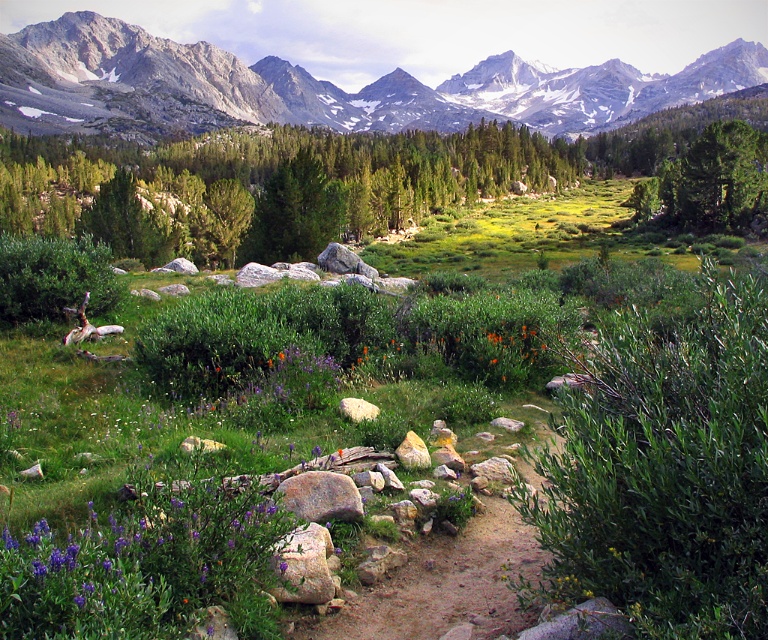
Question: Does gray rocky mountain range at upper center appear on the right side of rusty metallic rock at center?

Choices:
 (A) yes
 (B) no

Answer: (A)

Question: Can you confirm if gray rocky mountain range at upper center is thinner than green textured tree at upper right?

Choices:
 (A) yes
 (B) no

Answer: (B)

Question: Which object appears farthest from the camera in this image?

Choices:
 (A) gray rocky mountain range at upper center
 (B) rusty metallic rock at center
 (C) green leafy bush at center-right
 (D) green textured tree at upper right

Answer: (A)

Question: Which of the following is the closest to the observer?

Choices:
 (A) green textured tree at upper right
 (B) green leafy bush at center-right
 (C) rusty metallic rock at center

Answer: (B)

Question: Which point appears farthest from the camera in this image?

Choices:
 (A) (296, 596)
 (B) (422, 173)

Answer: (B)

Question: Can you confirm if green textured tree at upper right is positioned to the left of rusty metallic rock at center?

Choices:
 (A) yes
 (B) no

Answer: (B)